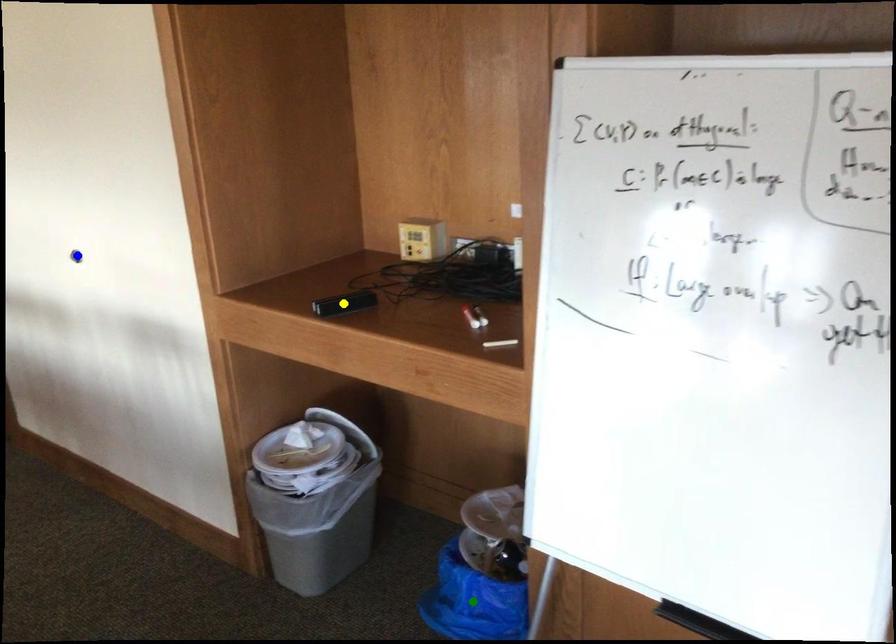
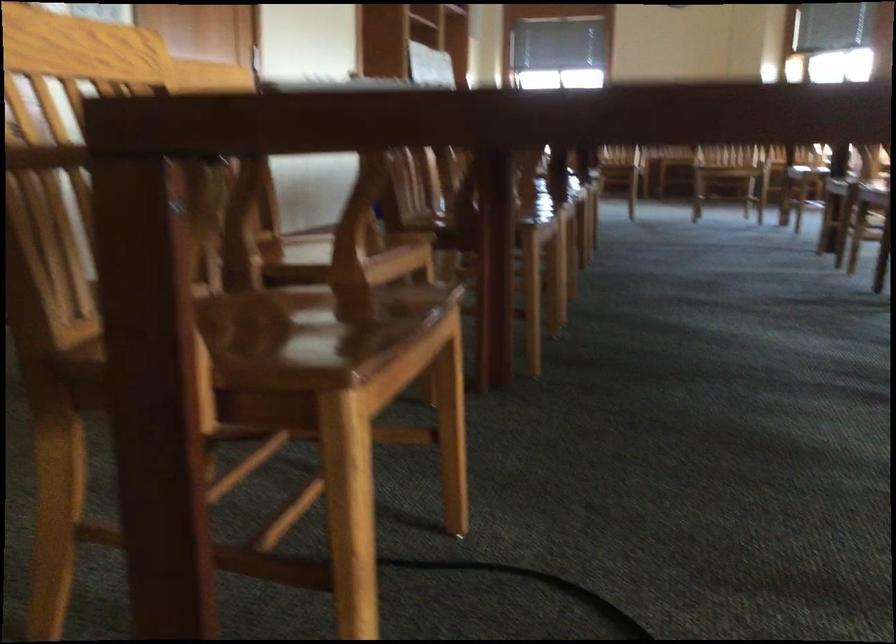
I am providing you with two images of the same scene from different viewpoints. Three points are marked in image1. Which point corresponds to a part or object that is occluded in image2?In image1, three points are marked. Which of them correspond to a part or object that is occluded in image2?Among the three points shown in image1, which one corresponds to a part or object that is no longer visible due to occlusion in image2?

blue point, yellow point, green point cannot be seen in image2.